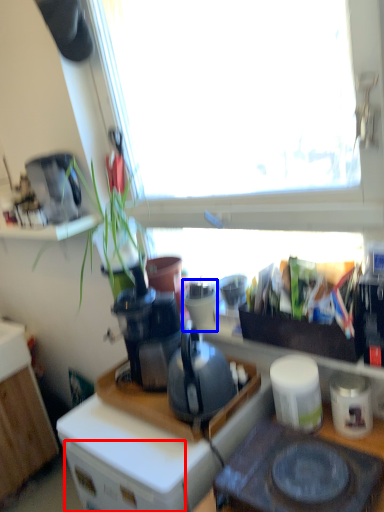
Question: Which object is further to the camera taking this photo, drawer (highlighted by a red box) or appliance (highlighted by a blue box)?

Choices:
 (A) drawer
 (B) appliance

Answer: (B)